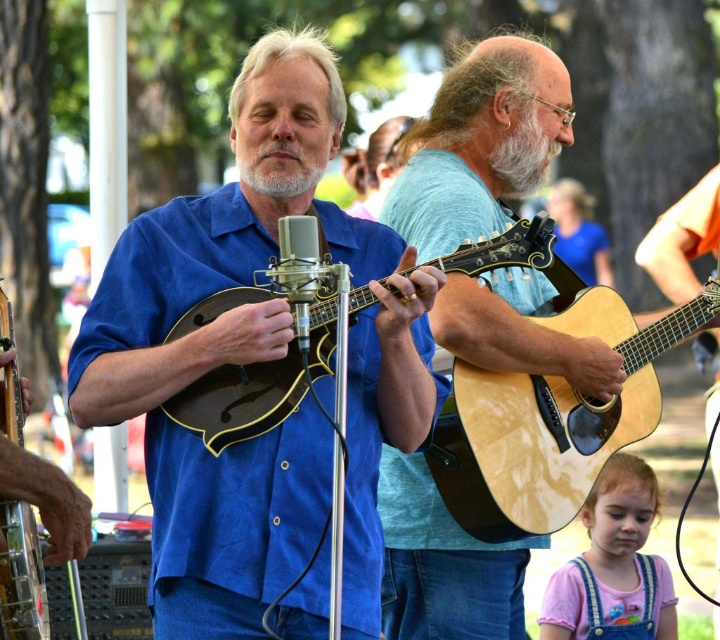
You are a photographer trying to capture a closeup of both the light brown wood guitar at center and the matte black mandolin at center. Since you can only focus on one object at a time, which one should you choose to ensure the other is still in the frame?

The light brown wood guitar at center is to the right of the matte black mandolin at center, so if you focus on the matte black mandolin at center, the light brown wood guitar at center will still be in the frame to its right.

You are a photographer setting up for a live performance. You need to capture a closeup shot of both the natural wood acoustic guitar at center and the silver metallic microphone at center. Which object should you adjust your camera angle to look upwards to focus on?

The silver metallic microphone at center is located above the natural wood acoustic guitar at center, so you should adjust your camera angle to look upwards to focus on the silver metallic microphone at center.

You are a stagehand setting up for a performance. You need to place a protective cover over both the natural wood acoustic guitar at center and the silver metallic microphone at center. Which object requires a larger cover?

The natural wood acoustic guitar at center requires a larger cover because it has a larger size compared to the silver metallic microphone at center.